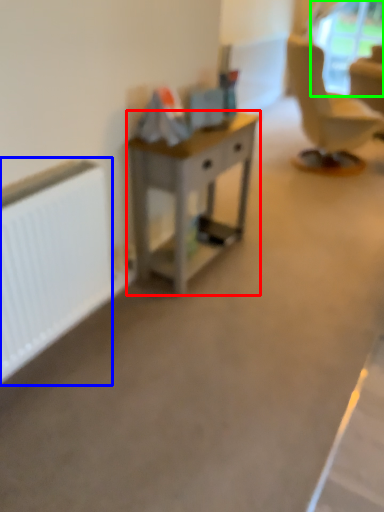
Question: Considering the real-world distances, which object is farthest from desk (highlighted by a red box)? radiator (highlighted by a blue box) or window screen (highlighted by a green box)?

Choices:
 (A) radiator
 (B) window screen

Answer: (B)